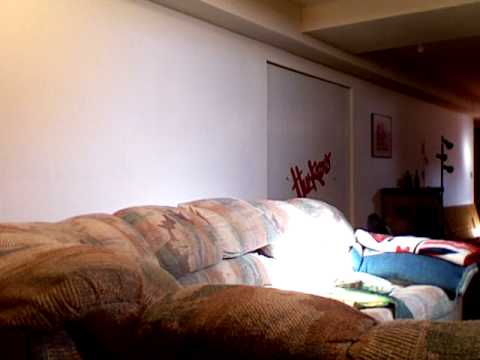
At what (x,y) coordinates should I click in order to perform the action: click on cabinet. Please return your answer as a coordinate pair (x, y). This screenshot has width=480, height=360. Looking at the image, I should click on (402, 193).